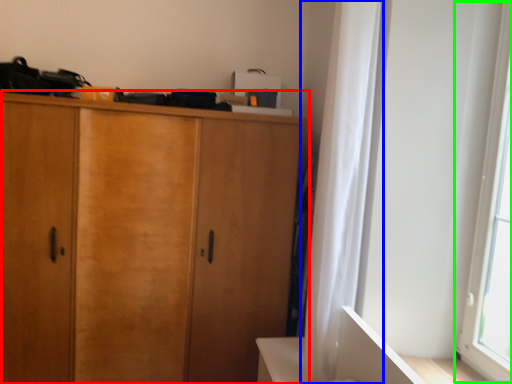
Question: Which is nearer to the cupboard (highlighted by a red box)? curtain (highlighted by a blue box) or window screen (highlighted by a green box).

Choices:
 (A) curtain
 (B) window screen

Answer: (A)